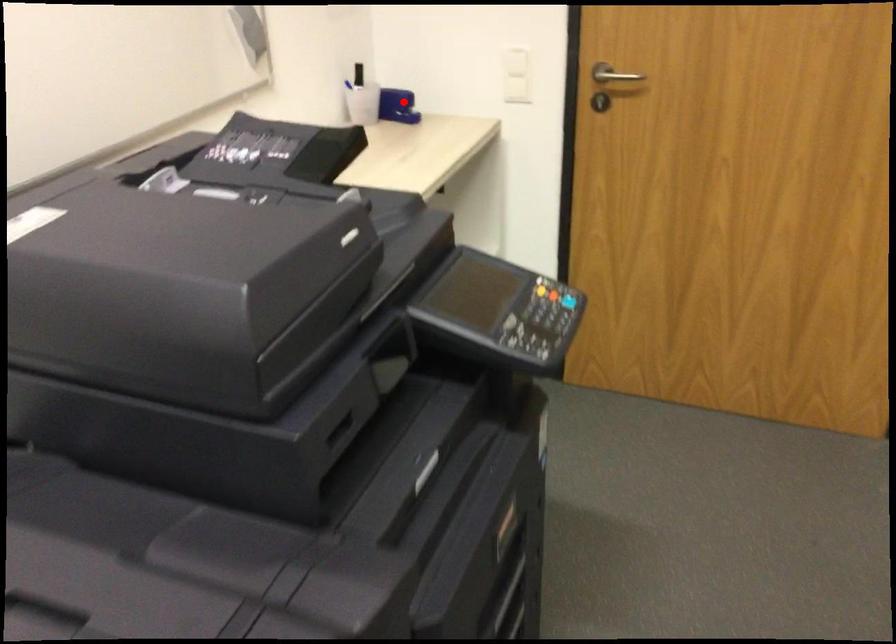
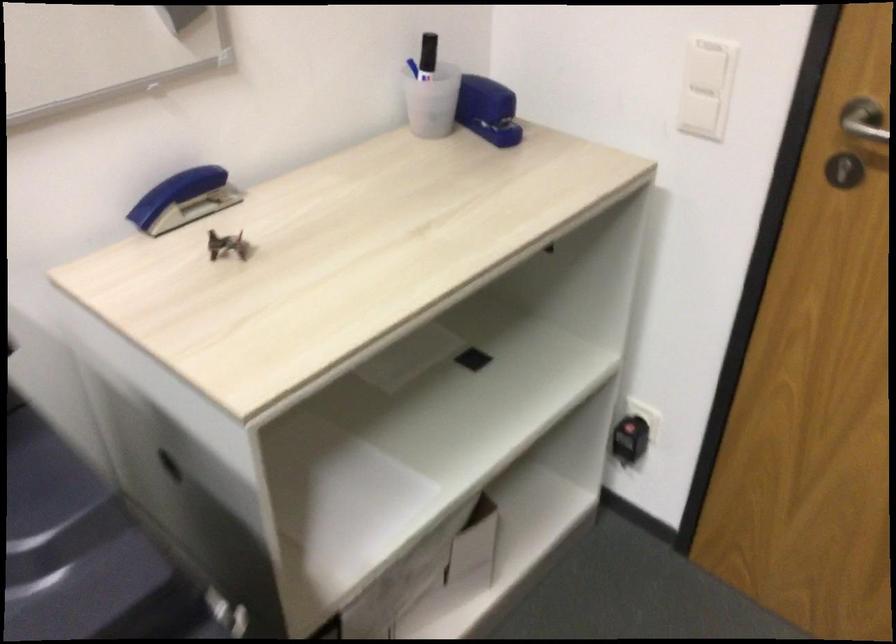
Question: I am providing you with two images of the same scene from different viewpoints. In image1, a red point is highlighted. Considering the same 3D point in image2, which of the following is correct?

Choices:
 (A) It is closer
 (B) It is farther

Answer: (A)